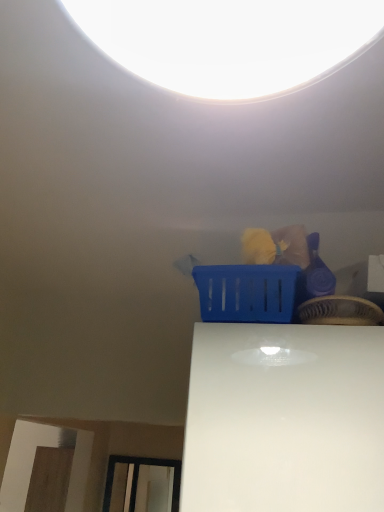
Question: Do you think blue plastic basket at upper center, acting as the first basket starting from the right, is within blue plastic basket at upper center, the 1th basket when ordered from left to right, or outside of it?

Choices:
 (A) outside
 (B) inside

Answer: (A)

Question: From a real-world perspective, is blue plastic basket at upper center, acting as the first basket starting from the right, positioned above or below blue plastic basket at upper center, which is the second basket in right-to-left order?

Choices:
 (A) below
 (B) above

Answer: (A)

Question: Is point (331, 294) positioned closer to the camera than point (201, 271)?

Choices:
 (A) closer
 (B) farther

Answer: (A)

Question: Looking at their shapes, would you say blue plastic basket at upper center, which is the second basket in right-to-left order, is wider or thinner than blue plastic basket at upper center, placed as the 2th basket when sorted from left to right?

Choices:
 (A) thin
 (B) wide

Answer: (B)

Question: Would you say blue plastic basket at upper center, the 1th basket when ordered from left to right, is inside or outside blue plastic basket at upper center, acting as the first basket starting from the right?

Choices:
 (A) inside
 (B) outside

Answer: (B)

Question: Is point pyautogui.click(x=220, y=308) positioned closer to the camera than point pyautogui.click(x=374, y=306)?

Choices:
 (A) farther
 (B) closer

Answer: (A)

Question: Looking at the image, does blue plastic basket at upper center, which is the second basket in right-to-left order, seem bigger or smaller compared to blue plastic basket at upper center, placed as the 2th basket when sorted from left to right?

Choices:
 (A) big
 (B) small

Answer: (A)